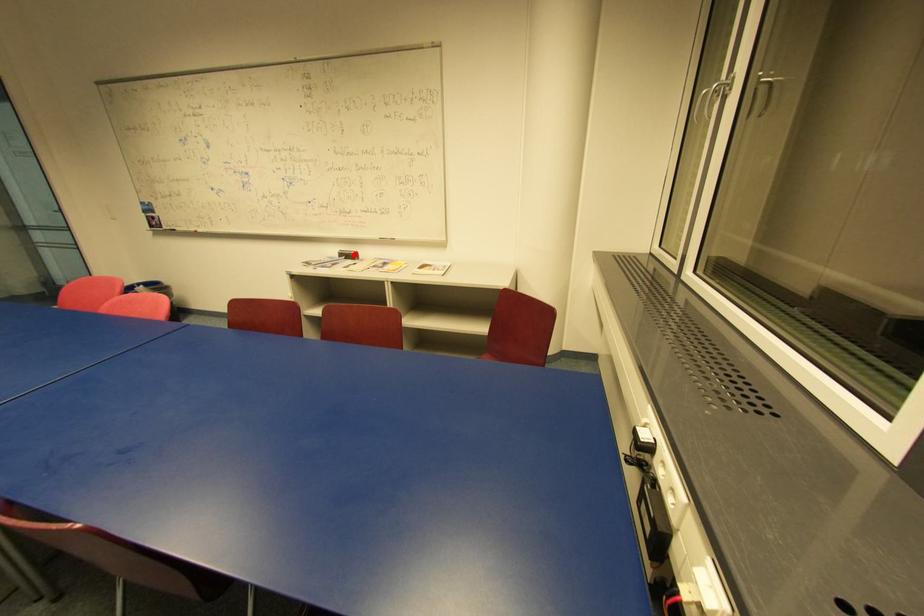
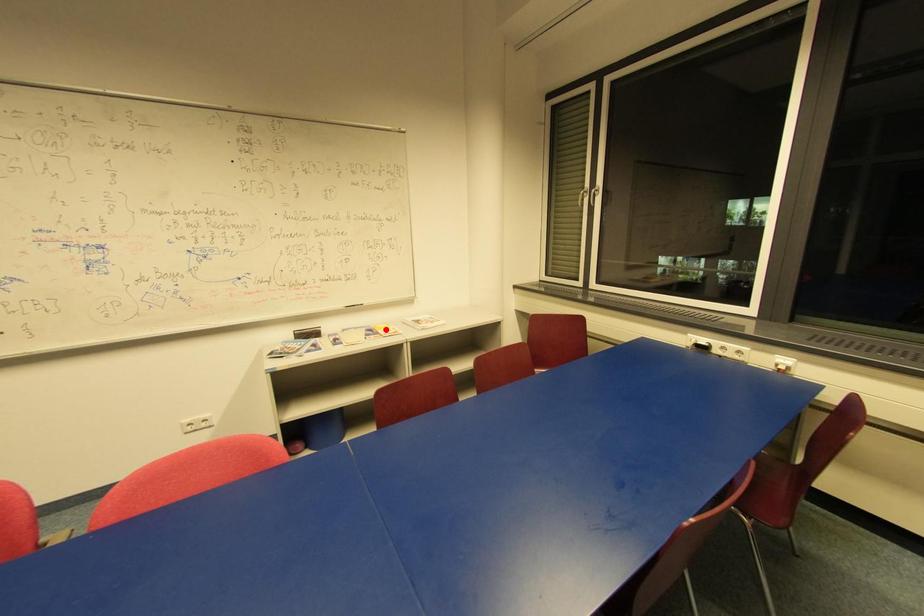
I am providing you with two images of the same scene from different viewpoints. A red point is marked on the first image and another point is marked on the second image. Is the red point in image1 aligned with the point shown in image2?

No